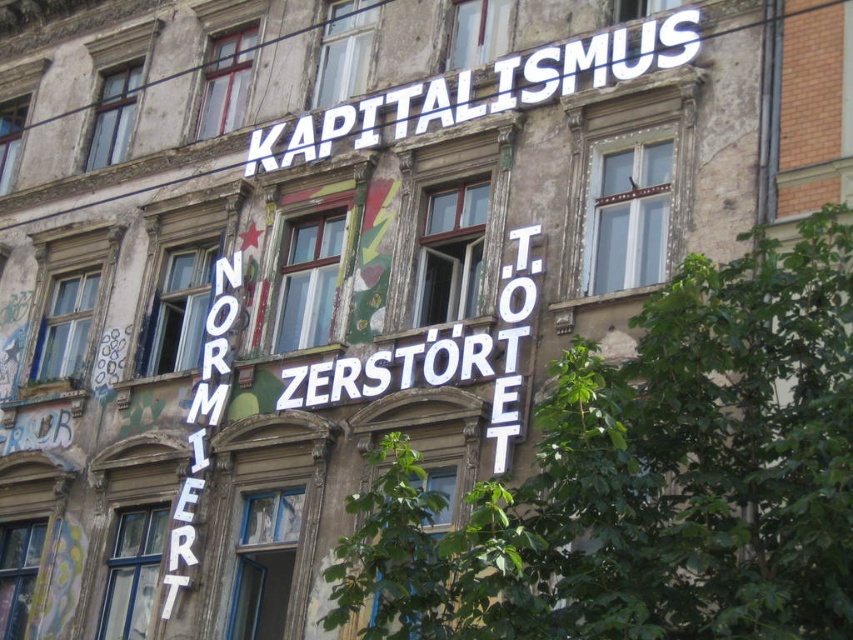
You are a delivery person trying to read the signs on the building. You notice two white plastic signs. Which one is closer to you, the white plastic sign at upper center or the white plastic letters at center?

The white plastic letters at center are behind the white plastic sign at upper center, so the white plastic sign at upper center is closer to you.